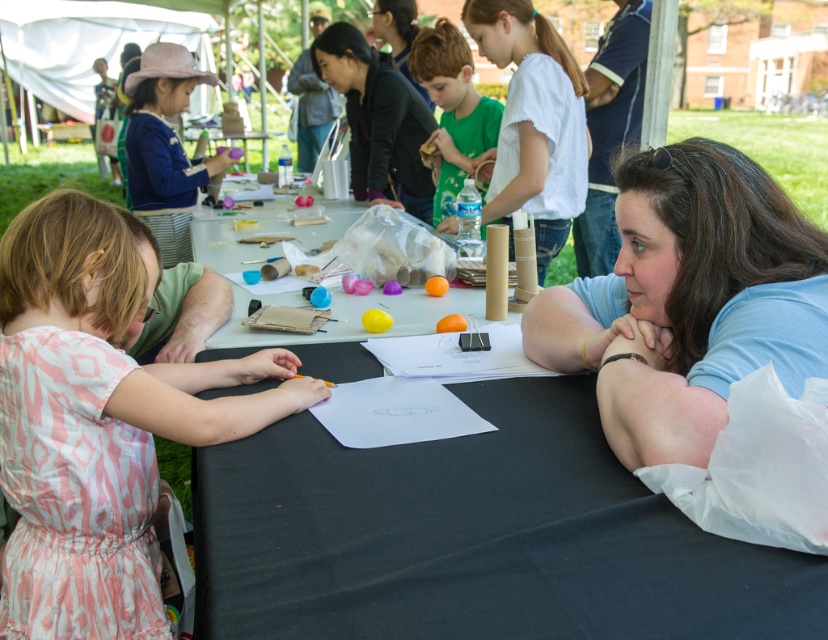
Question: Which point is closer to the camera?

Choices:
 (A) (566, 92)
 (B) (742, 289)
 (C) (610, 83)

Answer: (B)

Question: Does matte black shirt at center have a lesser width compared to green matte shirt at center?

Choices:
 (A) no
 (B) yes

Answer: (A)

Question: Estimate the real-world distances between objects in this image. Which object is closer to the white cotton shirt at upper center?

Choices:
 (A) pink fabric hat at upper left
 (B) blue shirt at center
 (C) black paper at center

Answer: (B)

Question: Is blue shirt at center behind white cotton shirt at upper center?

Choices:
 (A) no
 (B) yes

Answer: (A)

Question: Which point is closer to the camera?

Choices:
 (A) pink fabric hat at upper left
 (B) blue shirt at center
 (C) matte black shirt at center
 (D) green matte shirt at center

Answer: (B)

Question: Can you confirm if white cotton shirt at upper center is positioned below pink fabric hat at upper left?

Choices:
 (A) yes
 (B) no

Answer: (A)